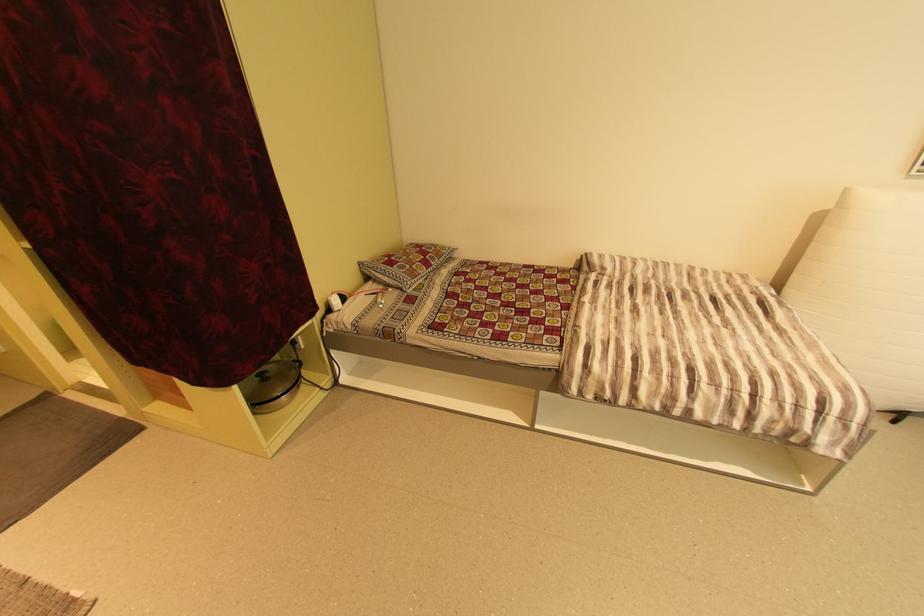
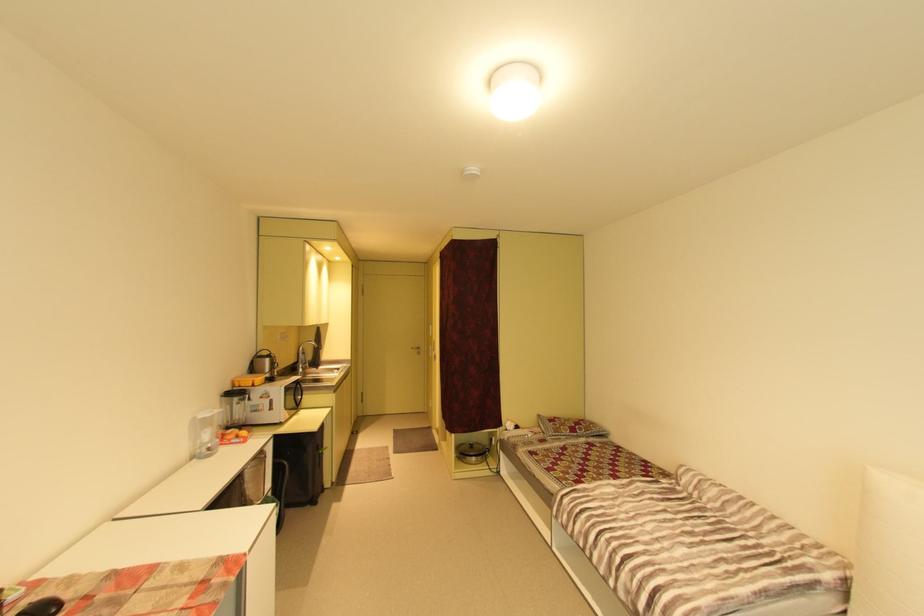
The point at [420,267] is marked in the first image. Where is the corresponding point in the second image?

(568, 428)